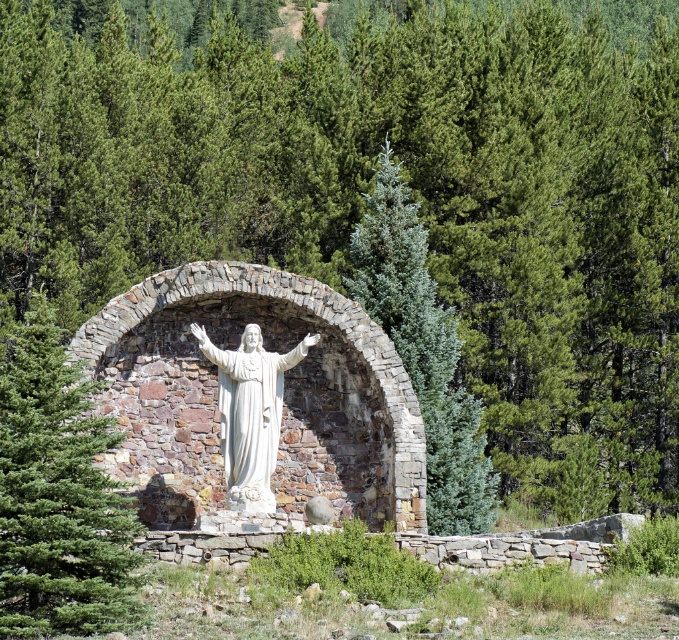
Based on the photo, does green textured stone arch at center appear over white marble statue at center?

Yes.

Is green textured stone arch at center thinner than white marble statue at center?

No.

Describe the element at coordinates (56, 493) in the screenshot. I see `green textured stone arch at center` at that location.

Locate an element on the screen. The height and width of the screenshot is (640, 679). green textured stone arch at center is located at coordinates (56, 493).

Which is in front, point (496, 474) or point (278, 422)?

Point (278, 422) is in front.

Identify the location of green textured pine tree at center. The width and height of the screenshot is (679, 640). (422, 352).

Can you confirm if green textured stone arch at center is taller than green textured pine tree at center?

No, green textured stone arch at center is not taller than green textured pine tree at center.

Is green textured stone arch at center wider than green textured pine tree at center?

Yes, green textured stone arch at center is wider than green textured pine tree at center.

Describe the element at coordinates (56, 493) in the screenshot. I see `green textured stone arch at center` at that location.

Find the location of a particular element. green textured stone arch at center is located at coordinates (56, 493).